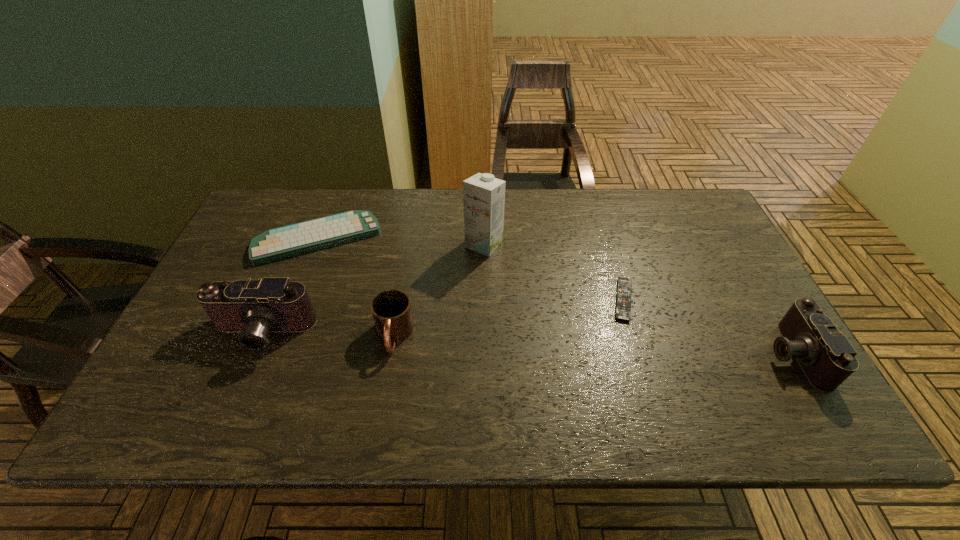
Image resolution: width=960 pixels, height=540 pixels. In order to click on free space at the near right corner of the desktop in this screenshot , I will do `click(804, 389)`.

In order to click on empty space between the left camera and the fourth object from right to left in this screenshot , I will do `click(328, 334)`.

Locate an element on the screen. This screenshot has width=960, height=540. free space between the fourth object from right to left and the computer keyboard is located at coordinates click(x=356, y=287).

Identify the location of vacant area that lies between the shortest object and the mug. (509, 318).

Where is `free spot between the fourth object from right to left and the shortest object`? The image size is (960, 540). free spot between the fourth object from right to left and the shortest object is located at coordinates (509, 318).

Locate an element on the screen. The image size is (960, 540). vacant point located between the mug and the fifth tallest object is located at coordinates tap(356, 287).

Find the location of a particular element. This screenshot has height=540, width=960. free space between the fifth object from left to right and the third object from left to right is located at coordinates (509, 318).

Where is `free space between the fifth shortest object and the second object from right to left`? free space between the fifth shortest object and the second object from right to left is located at coordinates (443, 316).

The image size is (960, 540). I want to click on empty location between the computer keyboard and the tallest object, so click(401, 242).

At what (x,y) coordinates should I click in order to perform the action: click on vacant area that lies between the shortest object and the third object from left to right. Please return your answer as a coordinate pair (x, y). The height and width of the screenshot is (540, 960). Looking at the image, I should click on (x=509, y=318).